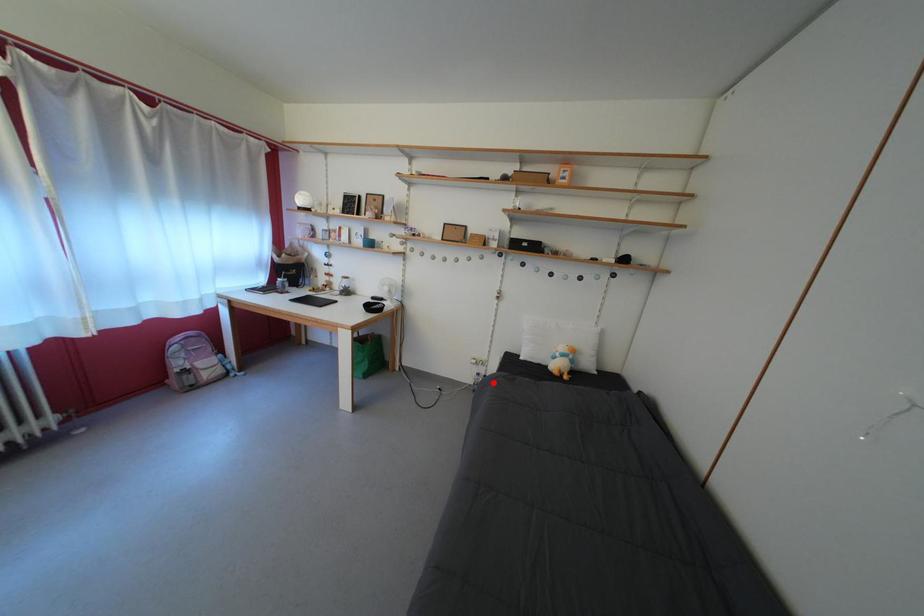
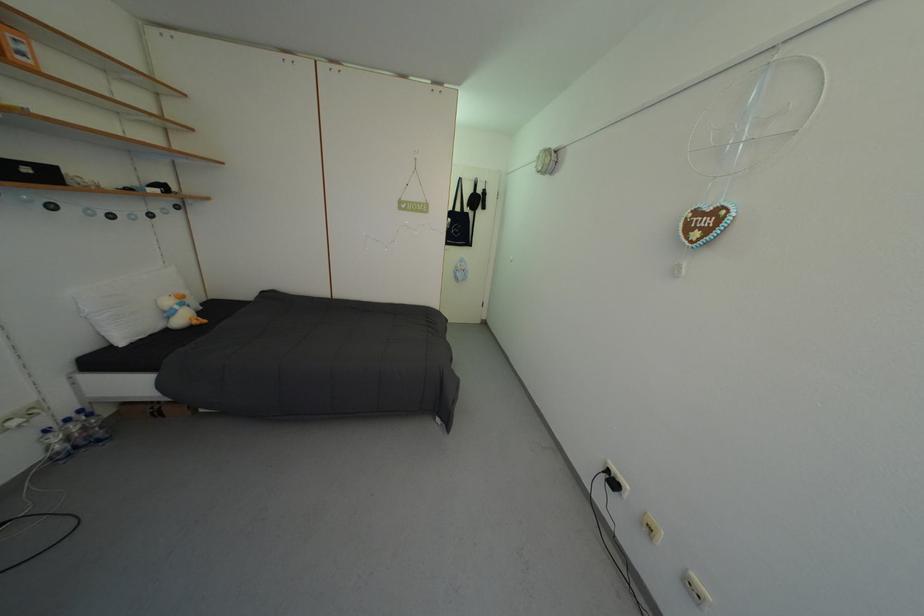
Locate, in the second image, the point that corresponds to the highlighted location in the first image.

(76, 426)